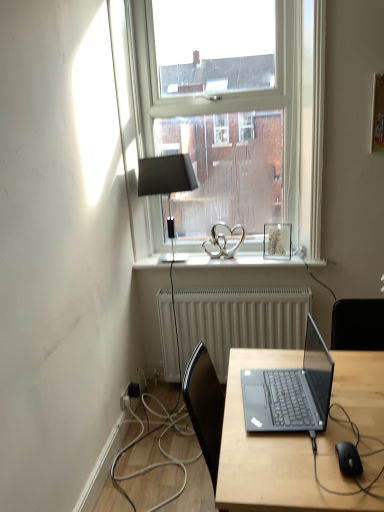
This screenshot has height=512, width=384. In order to click on vacant area in front of sleek black laptop at center in this screenshot , I will do `click(302, 462)`.